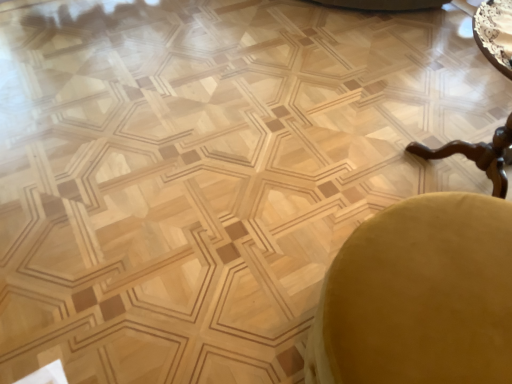
Locate an element on the screen. Image resolution: width=512 pixels, height=384 pixels. velvet yellow swivel chair at lower right is located at coordinates (419, 296).

The height and width of the screenshot is (384, 512). What do you see at coordinates (419, 296) in the screenshot?
I see `velvet yellow swivel chair at lower right` at bounding box center [419, 296].

Describe the element at coordinates (477, 155) in the screenshot. The height and width of the screenshot is (384, 512). I see `wooden polished table at right` at that location.

Where is `wooden polished table at right`? The width and height of the screenshot is (512, 384). wooden polished table at right is located at coordinates (477, 155).

In order to click on velvet yellow swivel chair at lower right in this screenshot , I will do `click(419, 296)`.

Does velvet yellow swivel chair at lower right appear on the right side of wooden polished table at right?

Incorrect, velvet yellow swivel chair at lower right is not on the right side of wooden polished table at right.

Is velvet yellow swivel chair at lower right further to the viewer compared to wooden polished table at right?

No, velvet yellow swivel chair at lower right is closer to the viewer.

Which is behind, point (482, 304) or point (508, 123)?

The point (508, 123) is more distant.

From the image's perspective, between velvet yellow swivel chair at lower right and wooden polished table at right, who is located below?

velvet yellow swivel chair at lower right, from the image's perspective.

From a real-world perspective, is velvet yellow swivel chair at lower right positioned over wooden polished table at right based on gravity?

Actually, velvet yellow swivel chair at lower right is physically below wooden polished table at right in the real world.

Is velvet yellow swivel chair at lower right wider than wooden polished table at right?

No.

Who is taller, velvet yellow swivel chair at lower right or wooden polished table at right?

wooden polished table at right is taller.

Which of these two, velvet yellow swivel chair at lower right or wooden polished table at right, is bigger?

With larger size is wooden polished table at right.

Can we say velvet yellow swivel chair at lower right lies outside wooden polished table at right?

Indeed, velvet yellow swivel chair at lower right is completely outside wooden polished table at right.

Is velvet yellow swivel chair at lower right next to wooden polished table at right and touching it?

No, velvet yellow swivel chair at lower right is not touching wooden polished table at right.

Is velvet yellow swivel chair at lower right oriented towards wooden polished table at right?

No, velvet yellow swivel chair at lower right is not turned towards wooden polished table at right.

How different are the orientations of velvet yellow swivel chair at lower right and wooden polished table at right in degrees?

90 degrees separate the facing orientations of velvet yellow swivel chair at lower right and wooden polished table at right.

Based on the photo, measure the distance from velvet yellow swivel chair at lower right to wooden polished table at right.

A distance of 81.29 centimeters exists between velvet yellow swivel chair at lower right and wooden polished table at right.

Locate an element on the screen. Image resolution: width=512 pixels, height=384 pixels. swivel chair below the wooden polished table at right (from a real-world perspective) is located at coordinates (419, 296).

Based on their positions, is wooden polished table at right located to the left or right of velvet yellow swivel chair at lower right?

Based on their positions, wooden polished table at right is located to the right of velvet yellow swivel chair at lower right.

Is wooden polished table at right closer to camera compared to velvet yellow swivel chair at lower right?

No, wooden polished table at right is behind velvet yellow swivel chair at lower right.

Considering the positions of point (494, 189) and point (452, 275), is point (494, 189) closer or farther from the camera than point (452, 275)?

Point (494, 189) is positioned farther from the camera compared to point (452, 275).

From the image's perspective, between wooden polished table at right and velvet yellow swivel chair at lower right, which one is located above?

wooden polished table at right appears higher in the image.

From a real-world perspective, which object rests below the other?

velvet yellow swivel chair at lower right.

In the scene shown: Which object is thinner, wooden polished table at right or velvet yellow swivel chair at lower right?

With smaller width is velvet yellow swivel chair at lower right.

Which of these two, wooden polished table at right or velvet yellow swivel chair at lower right, stands taller?

wooden polished table at right is taller.

Which of these two, wooden polished table at right or velvet yellow swivel chair at lower right, is smaller?

With smaller size is velvet yellow swivel chair at lower right.

Looking at this image, would you say wooden polished table at right contains velvet yellow swivel chair at lower right?

Actually, velvet yellow swivel chair at lower right is outside wooden polished table at right.

Is the surface of wooden polished table at right in direct contact with velvet yellow swivel chair at lower right?

No, wooden polished table at right is not next to velvet yellow swivel chair at lower right.

Is wooden polished table at right looking in the opposite direction of velvet yellow swivel chair at lower right?

No, wooden polished table at right is not facing the opposite direction of velvet yellow swivel chair at lower right.

How many degrees apart are the facing directions of wooden polished table at right and velvet yellow swivel chair at lower right?

The facing directions of wooden polished table at right and velvet yellow swivel chair at lower right are 90 degrees apart.

In order to click on cocktail table on the right of velvet yellow swivel chair at lower right in this screenshot , I will do `click(477, 155)`.

Where is `swivel chair that is in front of the wooden polished table at right`? swivel chair that is in front of the wooden polished table at right is located at coordinates (419, 296).

Locate an element on the screen. Image resolution: width=512 pixels, height=384 pixels. cocktail table that is behind the velvet yellow swivel chair at lower right is located at coordinates (477, 155).